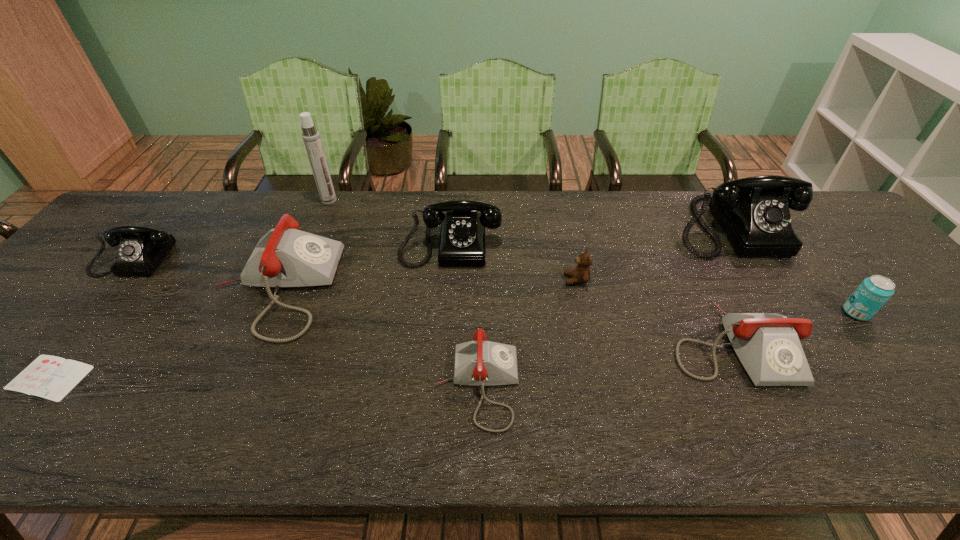
This screenshot has height=540, width=960. What are the coordinates of `the second closest object to the rightmost black telephone` in the screenshot? It's located at (768, 345).

Where is `object that is the ninth closest to the second smallest red telephone`? The height and width of the screenshot is (540, 960). object that is the ninth closest to the second smallest red telephone is located at coordinates (50, 377).

Identify which telephone is the third closest to the shortest telephone. Please provide its 2D coordinates. Your answer should be formatted as a tuple, i.e. [(x, y)], where the tuple contains the x and y coordinates of a point satisfying the conditions above.

[(768, 345)]

This screenshot has height=540, width=960. Find the location of `telephone that can be found as the second closest to the smallest black telephone`. telephone that can be found as the second closest to the smallest black telephone is located at coordinates (462, 242).

Identify which black telephone is the nearest to the ninth shortest object. Please provide its 2D coordinates. Your answer should be formatted as a tuple, i.e. [(x, y)], where the tuple contains the x and y coordinates of a point satisfying the conditions above.

[(462, 242)]

Identify the location of black telephone that is the closest one to the rightmost black telephone. The width and height of the screenshot is (960, 540). (462, 242).

Locate which red telephone is the second closest to the second red telephone from right to left. Please provide its 2D coordinates. Your answer should be formatted as a tuple, i.e. [(x, y)], where the tuple contains the x and y coordinates of a point satisfying the conditions above.

[(768, 345)]

Identify the location of red telephone that is the closest to the fifth shortest telephone. (285, 257).